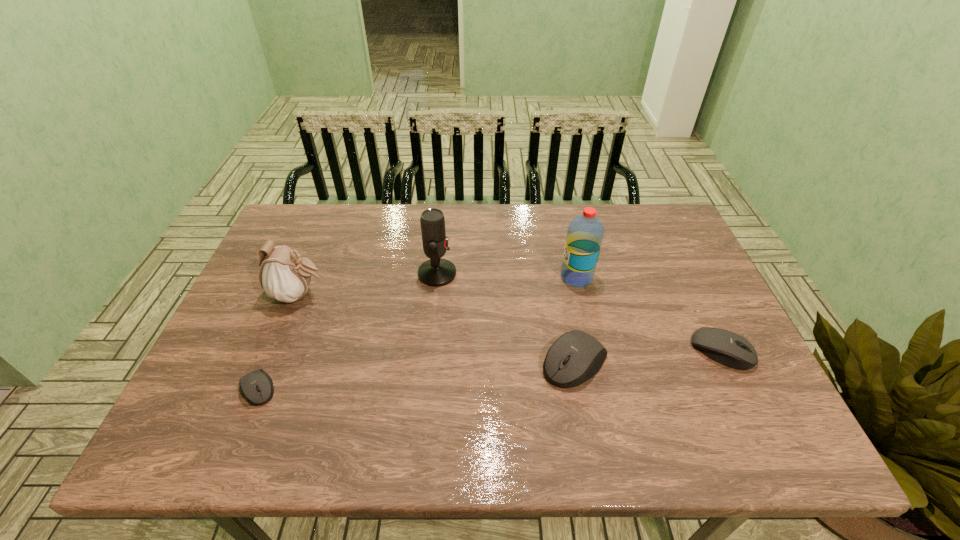
I want to click on free space between the second computer equipment from left to right and the pouch, so click(x=438, y=328).

Where is `unoccupied area between the shortest object and the microphone`? unoccupied area between the shortest object and the microphone is located at coordinates pos(348,331).

Identify the location of free space between the pouch and the second computer equipment from right to left. The height and width of the screenshot is (540, 960). (438, 328).

In order to click on free space between the fifth tallest object and the pouch in this screenshot , I will do `click(511, 322)`.

You are a GUI agent. You are given a task and a screenshot of the screen. Output one action in this format:
    pyautogui.click(x=<x>, y=<y>)
    Task: Click on the free space between the microphone and the water bottle
    This screenshot has height=540, width=960.
    Given the screenshot: What is the action you would take?
    pyautogui.click(x=507, y=275)

Find the location of `vacant area that lies between the shortest computer equipment and the second computer equipment from left to right`. vacant area that lies between the shortest computer equipment and the second computer equipment from left to right is located at coordinates (417, 375).

Point out which object is positioned as the third nearest to the second tallest computer equipment. Please provide its 2D coordinates. Your answer should be formatted as a tuple, i.e. [(x, y)], where the tuple contains the x and y coordinates of a point satisfying the conditions above.

[(437, 271)]

Locate an element on the screen. This screenshot has width=960, height=540. object that stands as the fifth closest to the fourth object from right to left is located at coordinates (726, 347).

Choose which computer equipment is the nearest neighbor to the shortest computer equipment. Please provide its 2D coordinates. Your answer should be formatted as a tuple, i.e. [(x, y)], where the tuple contains the x and y coordinates of a point satisfying the conditions above.

[(575, 357)]

I want to click on computer equipment that is the second closest to the water bottle, so click(726, 347).